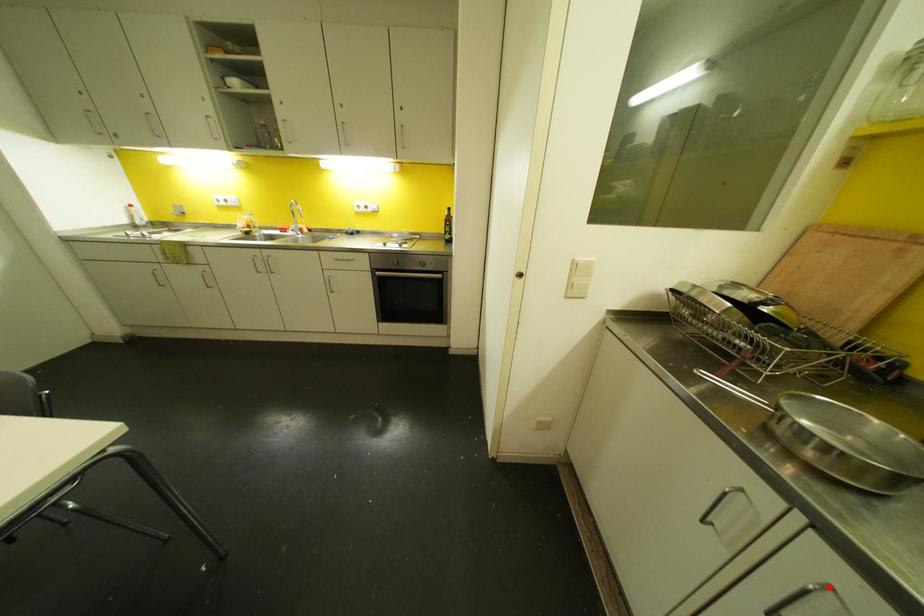
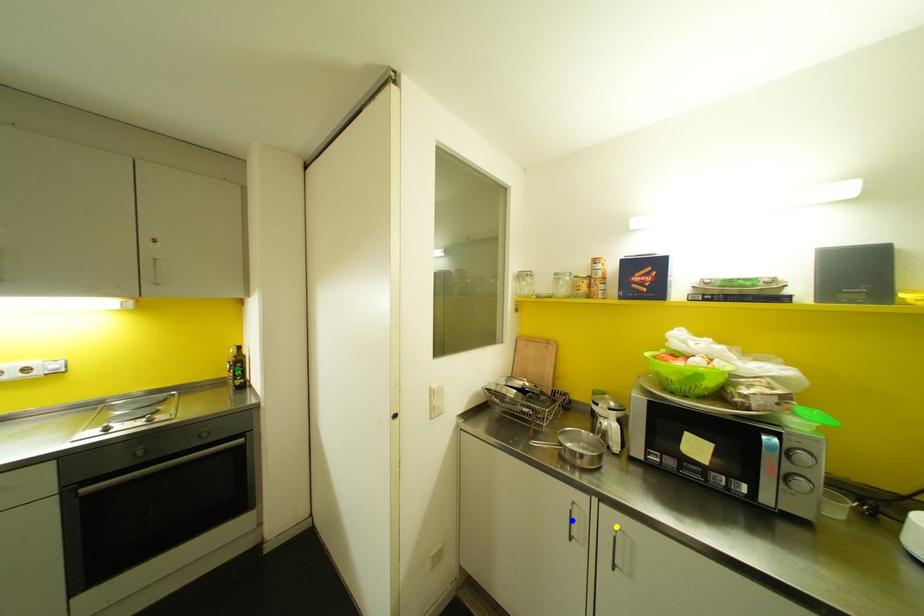
Question: I am providing you with two images of the same scene from different viewpoints. A red point is marked on the first image. You are given multiple points on the second image. In image 2, which mark is for the same physical point as the one in image 1?

Choices:
 (A) yellow point
 (B) blue point
 (C) green point

Answer: (A)